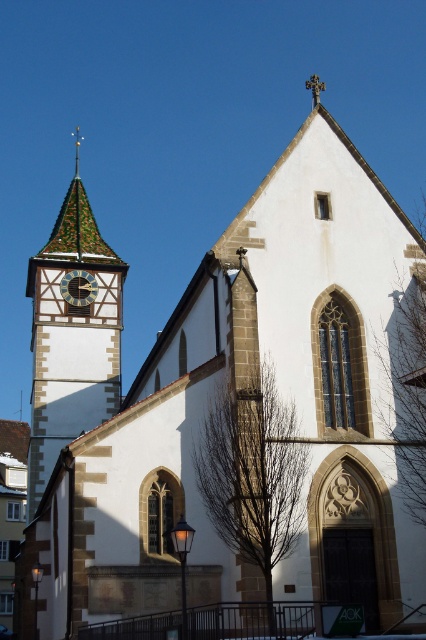
Is point (51, 330) positioned after point (68, 284)?

That is False.

Who is positioned more to the right, green-tiled clock tower at left or matte black clock at upper left?

matte black clock at upper left

What do you see at coordinates (71, 337) in the screenshot? I see `green-tiled clock tower at left` at bounding box center [71, 337].

I want to click on green-tiled clock tower at left, so click(x=71, y=337).